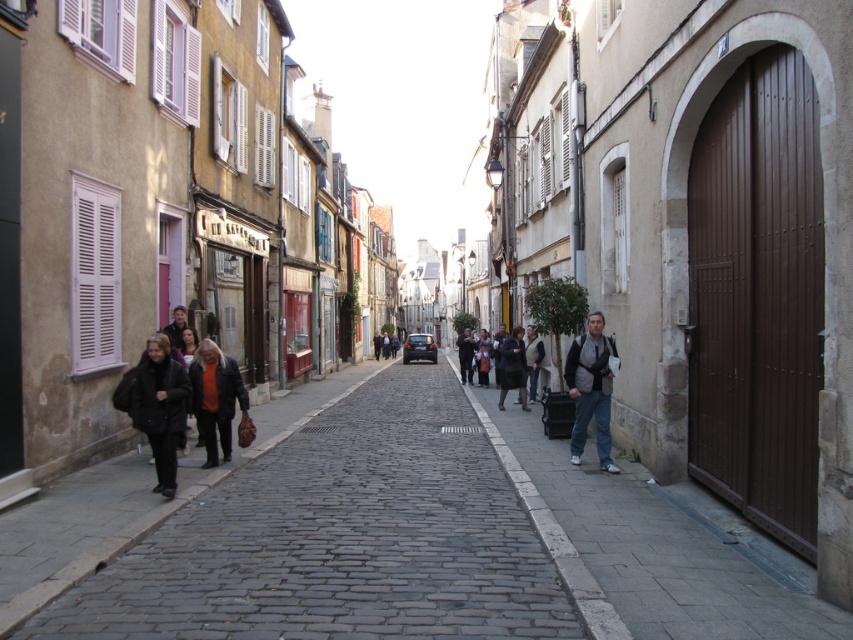
Question: Is orange sweater at center closer to the viewer compared to dark brown leather coat at center?

Choices:
 (A) yes
 (B) no

Answer: (A)

Question: Does dark brown leather jacket at center have a greater width compared to dark brown leather coat at center?

Choices:
 (A) no
 (B) yes

Answer: (A)

Question: Which point is closer to the camera taking this photo?

Choices:
 (A) (146, 428)
 (B) (579, 444)
 (C) (202, 376)

Answer: (A)

Question: Which object is the farthest from the denim jacket at lower right?

Choices:
 (A) gray fabric backpack at right
 (B) dark brown leather jacket at center

Answer: (B)

Question: Is the position of denim jacket at lower right more distant than that of black matte jacket at lower left?

Choices:
 (A) yes
 (B) no

Answer: (B)

Question: Among these points, which one is nearest to the camera?

Choices:
 (A) (637, 630)
 (B) (201, 406)
 (C) (173, 438)
 (D) (577, 394)

Answer: (A)